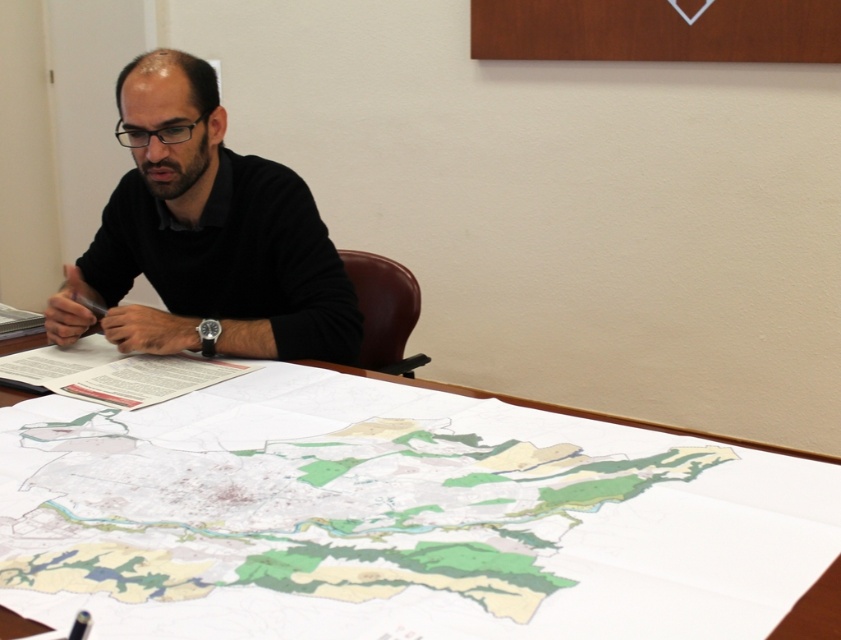
Question: Does white paper map at center lie in front of black matte shirt at upper left?

Choices:
 (A) yes
 (B) no

Answer: (A)

Question: Is white paper map at center closer to the viewer compared to black matte shirt at upper left?

Choices:
 (A) yes
 (B) no

Answer: (A)

Question: Does white paper map at center appear under black matte shirt at upper left?

Choices:
 (A) no
 (B) yes

Answer: (B)

Question: Which point is closer to the camera taking this photo?

Choices:
 (A) (183, 317)
 (B) (625, 634)

Answer: (B)

Question: Which point is closer to the camera?

Choices:
 (A) (56, 336)
 (B) (273, 554)

Answer: (B)